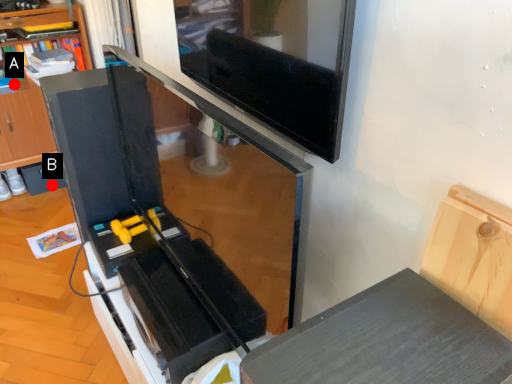
Question: Two points are circled on the image, labeled by A and B beside each circle. Which point is closer to the camera?

Choices:
 (A) A is closer
 (B) B is closer

Answer: (A)